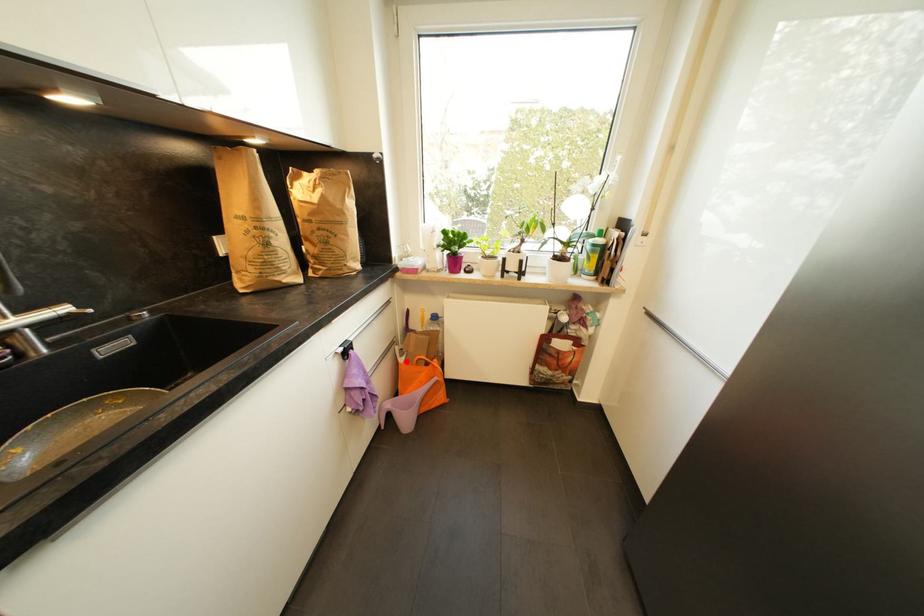
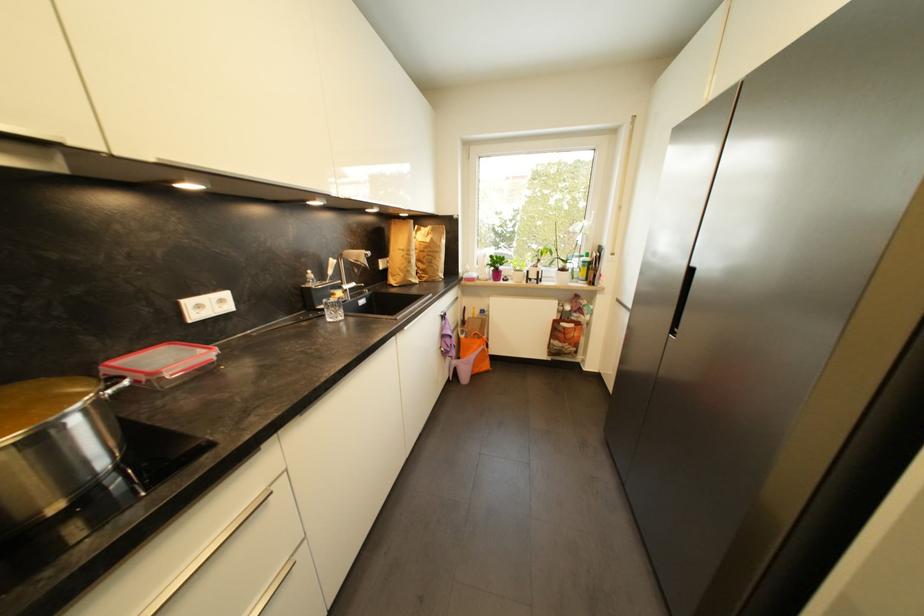
Locate, in the second image, the point that corresponds to the highlighted location in the first image.

(468, 339)